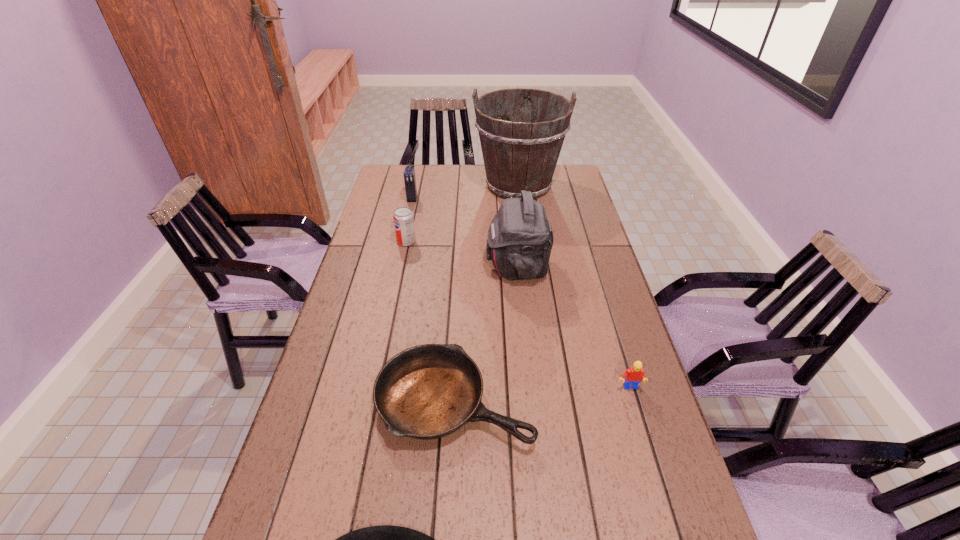
Find the location of a particular element. This screenshot has height=540, width=960. free region at the far edge of the desktop is located at coordinates (482, 176).

In the image, there is a desktop. Find the location of `vacant space at the left edge`. vacant space at the left edge is located at coordinates [370, 266].

This screenshot has width=960, height=540. I want to click on free space at the right edge of the desktop, so click(x=571, y=202).

In the image, there is a desktop. Where is `vacant space at the far left corner`? vacant space at the far left corner is located at coordinates (399, 165).

You are a GUI agent. You are given a task and a screenshot of the screen. Output one action in this format:
    pyautogui.click(x=<x>, y=<y>)
    Task: Click on the vacant space at the far right corner
    
    Given the screenshot: What is the action you would take?
    pyautogui.click(x=574, y=171)

I want to click on vacant area between the shoulder bag and the Lego, so click(x=573, y=327).

Where is `empty space that is in between the second tallest object and the clutch bag`? This screenshot has width=960, height=540. empty space that is in between the second tallest object and the clutch bag is located at coordinates tap(465, 232).

The image size is (960, 540). Find the location of `vacant space in between the bucket and the Lego`. vacant space in between the bucket and the Lego is located at coordinates (574, 287).

Where is `vacant area that lies between the bucket and the Lego`? Image resolution: width=960 pixels, height=540 pixels. vacant area that lies between the bucket and the Lego is located at coordinates point(574,287).

At what (x,y) coordinates should I click in order to perform the action: click on blank region between the frying pan and the soda. Please return your answer as a coordinate pair (x, y). The width and height of the screenshot is (960, 540). Looking at the image, I should click on (430, 321).